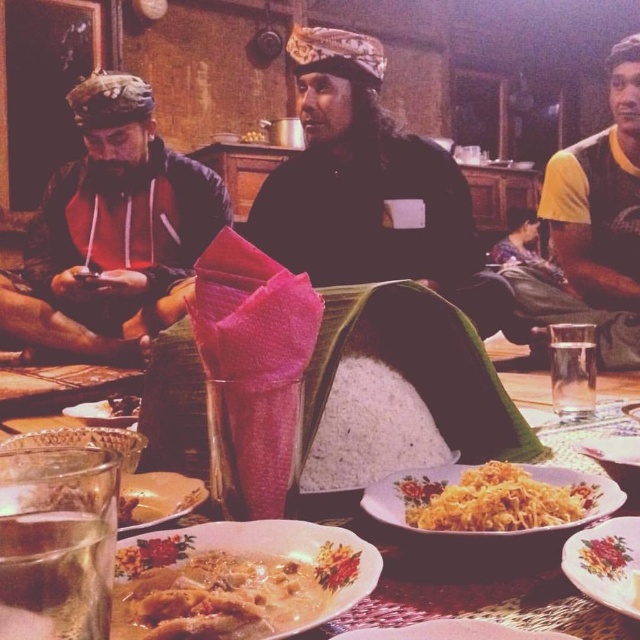
You are sitting at the table and want to pass the yellow fabric shirt at right the dish from the floral ceramic plates at center. Which direction should you move the dish?

The floral ceramic plates at center is to the left of the yellow fabric shirt at right, so you should move the dish to the right towards the yellow fabric shirt at right.

You are a guest at this dinner and want to reach for the white rice at center and the matte yellow plate at center. Which one is closer to you if you are sitting directly across from the table?

The matte yellow plate at center is closer to you because the white rice at center is above it, meaning the plate is positioned lower and nearer to your reach.

You are sitting at the table in the rustic dining area and want to reach for an item located at point (630, 602). However, there is an obstacle at point (138, 413). Will you be able to reach the item without moving around the obstacle?

Point (630, 602) is in front of point (138, 413), so you can reach the item at point (630, 602) without moving around the obstacle because it is closer to you and not blocked by the obstacle at point (138, 413).